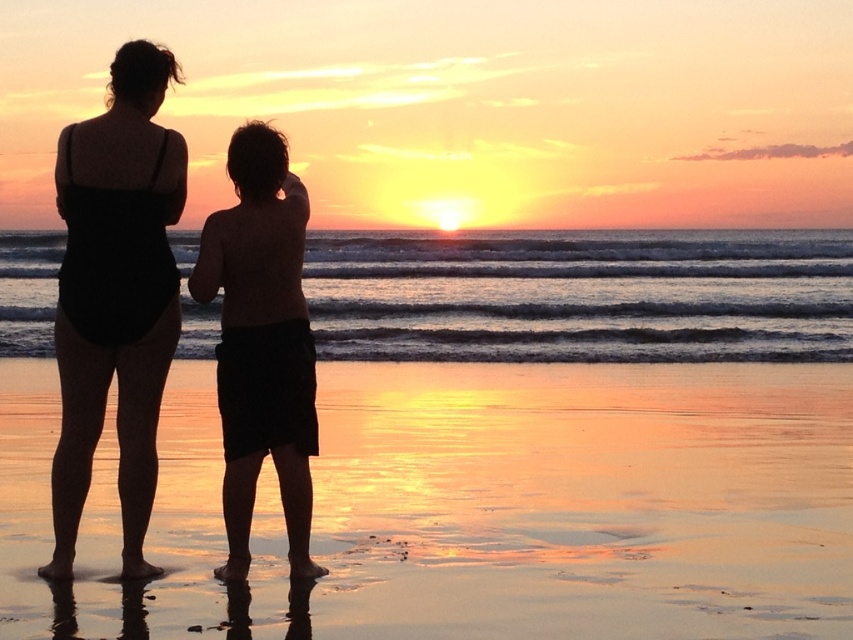
Is point (67, 358) positioned before point (294, 509)?

Yes, it is in front of point (294, 509).

Can you confirm if black matte swimsuit at left is wider than silhouette shorts at center?

Yes.

Which is in front, point (126, 472) or point (277, 346)?

Point (277, 346) is more forward.

The width and height of the screenshot is (853, 640). Identify the location of black matte swimsuit at left. (115, 298).

Can you confirm if shiny sand at lower center is wider than black matte swimsuit at left?

Yes, shiny sand at lower center is wider than black matte swimsuit at left.

You are a GUI agent. You are given a task and a screenshot of the screen. Output one action in this format:
    pyautogui.click(x=<x>, y=<y>)
    Task: Click on the shiny sand at lower center
    
    Given the screenshot: What is the action you would take?
    pyautogui.click(x=583, y=500)

This screenshot has width=853, height=640. Find the location of `shiny sand at lower center`. shiny sand at lower center is located at coordinates (583, 500).

Between shiny sand at lower center and silhouette shorts at center, which one appears on the left side from the viewer's perspective?

shiny sand at lower center is more to the left.

Does point (785, 508) come in front of point (305, 308)?

No, it is behind (305, 308).

I want to click on shiny sand at lower center, so click(x=583, y=500).